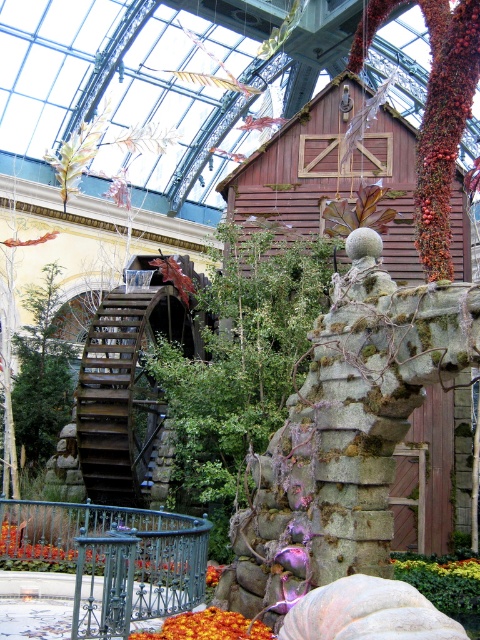
Question: Does green leafy plant at center lie in front of orange matte flower at lower center?

Choices:
 (A) no
 (B) yes

Answer: (A)

Question: Is green leafy plant at center to the right of orange matte flower at lower center from the viewer's perspective?

Choices:
 (A) no
 (B) yes

Answer: (B)

Question: Does green leafy plant at center appear on the right side of orange matte flower at lower center?

Choices:
 (A) yes
 (B) no

Answer: (A)